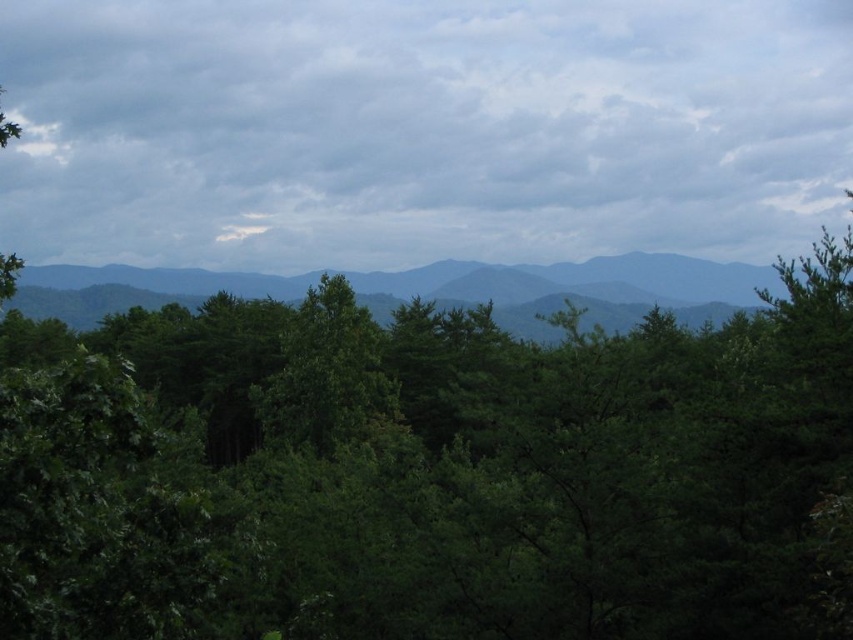
Based on the photo, you are standing at the origin point in the forest. The green leafy tree at center is marked at coordinates 0.739, 0.505. If you want to walk directly towards this tree, which direction should you head?

To reach the green leafy tree at center located at coordinates (x=430, y=472) from the origin, you should head northeast since the x and y coordinates are both positive, indicating a diagonal direction towards the upper right.

You are a hiker who wants to know the distance between the green leafy tree at center and the green leafy forest at center. Can you tell me how far apart they are?

The green leafy tree at center and the green leafy forest at center are 104.00 meters apart.